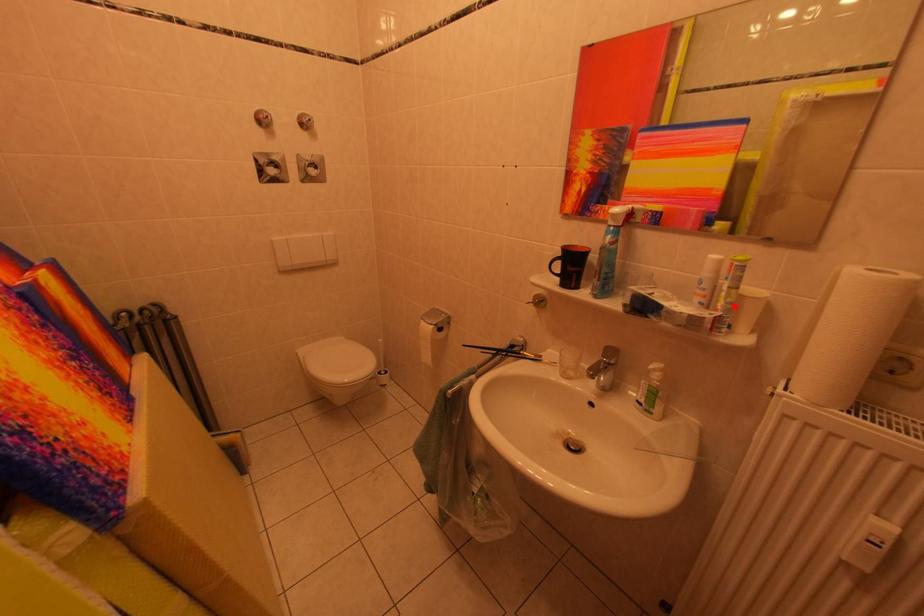
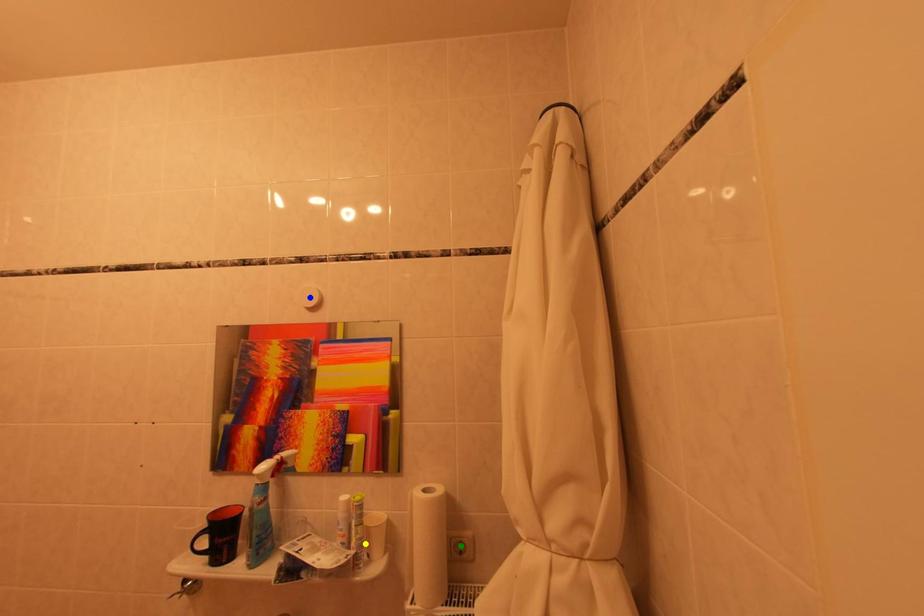
Question: I am providing you with two images of the same scene from different viewpoints. A red point is marked on the first image. You are given multiple points on the second image. Which spot in image 2 lines up with the point in image 1?

Choices:
 (A) yellow point
 (B) green point
 (C) blue point

Answer: (A)